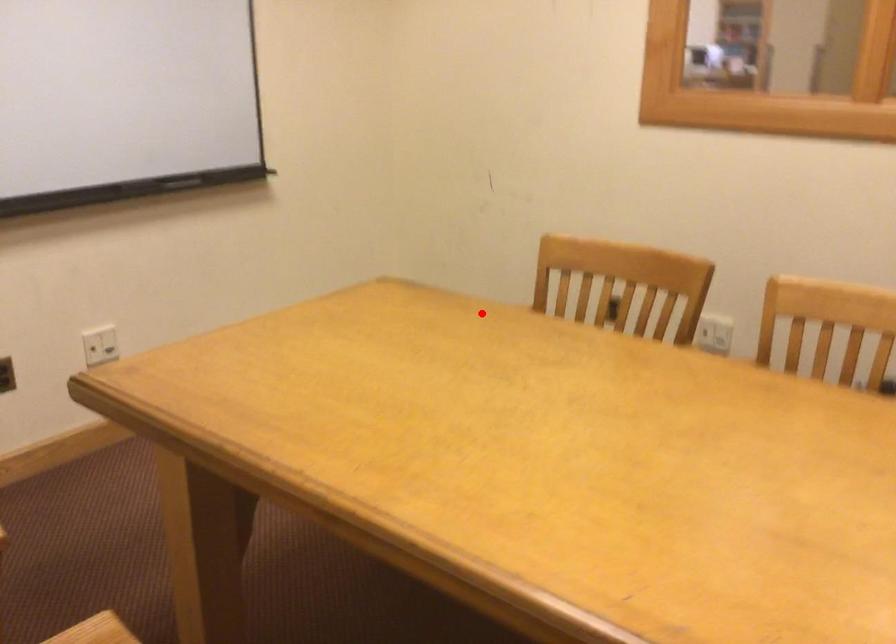
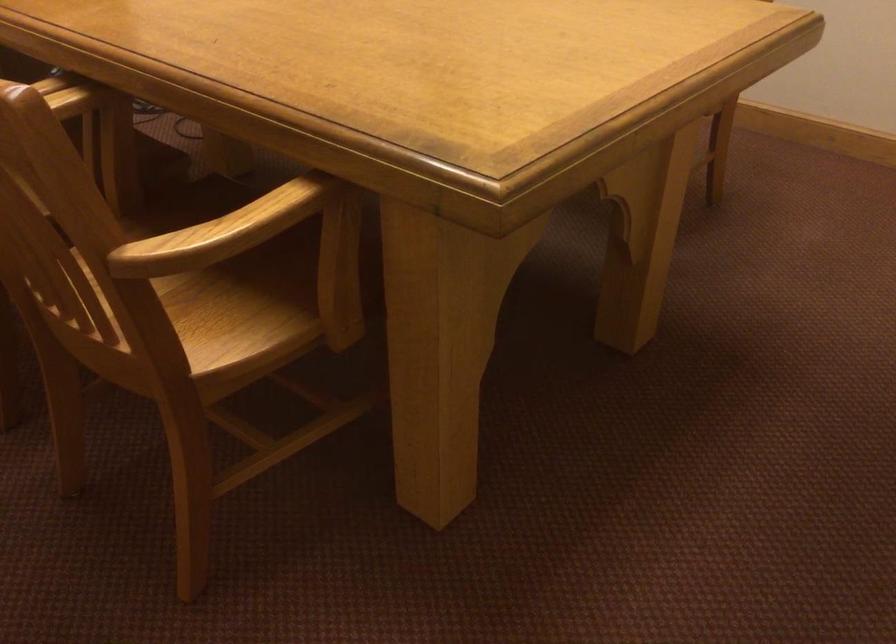
The point at the highlighted location is marked in the first image. Where is the corresponding point in the second image?

(221, 232)